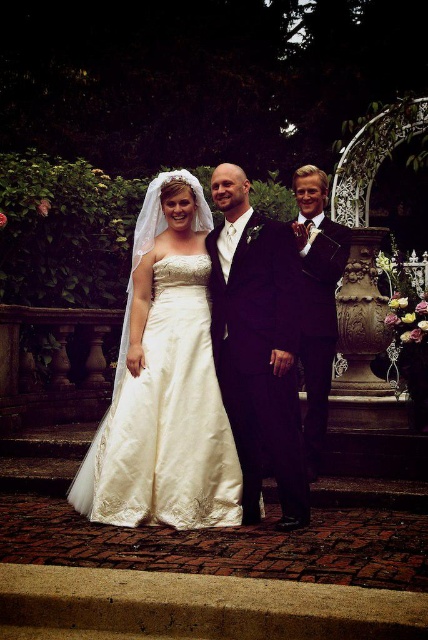
Question: Can you confirm if satin dress at center is wider than satin black suit at center?

Choices:
 (A) no
 (B) yes

Answer: (B)

Question: Which point is closer to the camera taking this photo?

Choices:
 (A) (216, 332)
 (B) (172, 493)

Answer: (B)

Question: Which point is farther from the camera taking this photo?

Choices:
 (A) click(326, 406)
 (B) click(247, 449)
 (C) click(175, 380)

Answer: (A)

Question: Can you confirm if satin black suit at center is positioned below satin suit at right?

Choices:
 (A) no
 (B) yes

Answer: (B)

Question: Which of the following is the farthest from the observer?

Choices:
 (A) satin black suit at center
 (B) satin dress at center

Answer: (B)

Question: Where is satin dress at center located in relation to satin black suit at center in the image?

Choices:
 (A) below
 (B) above

Answer: (A)